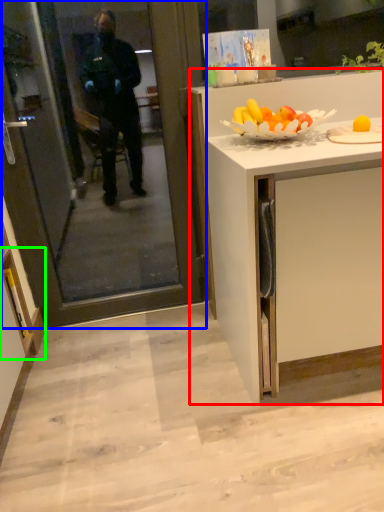
Question: Which is nearer to the cabinetry (highlighted by a red box)? screen door (highlighted by a blue box) or cabinetry (highlighted by a green box).

Choices:
 (A) screen door
 (B) cabinetry

Answer: (A)